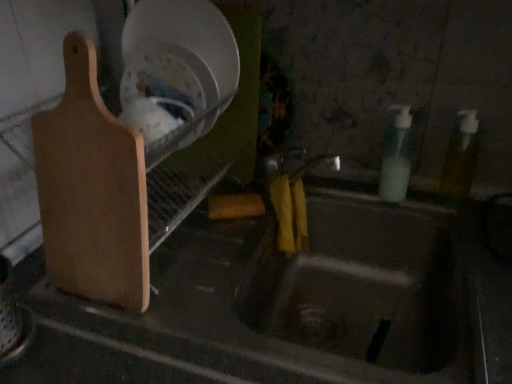
Where is `metallic sink at center`? metallic sink at center is located at coordinates (357, 285).

Describe the element at coordinates (396, 157) in the screenshot. The height and width of the screenshot is (384, 512). I see `translucent plastic soap dispenser at right, which is the first bottle in left-to-right order` at that location.

The height and width of the screenshot is (384, 512). What do you see at coordinates (92, 190) in the screenshot?
I see `light brown wood cutting board at left` at bounding box center [92, 190].

The width and height of the screenshot is (512, 384). In order to click on metallic sink at center in this screenshot , I will do `click(357, 285)`.

Does translucent plastic soap dispenser at right, which ranks as the second bottle in right-to-left order, turn towards translucent yellow bottle at right, the 2th bottle when ordered from left to right?

No, translucent plastic soap dispenser at right, which ranks as the second bottle in right-to-left order, does not turn towards translucent yellow bottle at right, the 2th bottle when ordered from left to right.

Can you tell me how much translucent plastic soap dispenser at right, which ranks as the second bottle in right-to-left order, and translucent yellow bottle at right, the 2th bottle when ordered from left to right, differ in facing direction?

The angular difference between translucent plastic soap dispenser at right, which ranks as the second bottle in right-to-left order, and translucent yellow bottle at right, the 2th bottle when ordered from left to right, is 0.00633 degrees.

You are a GUI agent. You are given a task and a screenshot of the screen. Output one action in this format:
    pyautogui.click(x=<x>, y=<y>)
    Task: Click on the bottle below the translucent yellow bottle at right, the 2th bottle when ordered from left to right (from a real-world perspective)
    This screenshot has width=512, height=384.
    Given the screenshot: What is the action you would take?
    pos(396,157)

Is translucent plastic soap dispenser at right, which ranks as the second bottle in right-to-left order, not inside translucent yellow bottle at right, the first bottle when ordered from right to left?

translucent plastic soap dispenser at right, which ranks as the second bottle in right-to-left order, is positioned outside translucent yellow bottle at right, the first bottle when ordered from right to left.

Which object is closer to the camera taking this photo, translucent plastic soap dispenser at right, which ranks as the second bottle in right-to-left order, or metallic sink at center?

metallic sink at center.

Between translucent plastic soap dispenser at right, which is the first bottle in left-to-right order, and metallic sink at center, which one appears on the right side from the viewer's perspective?

From the viewer's perspective, translucent plastic soap dispenser at right, which is the first bottle in left-to-right order, appears more on the right side.

Is metallic sink at center a part of translucent plastic soap dispenser at right, which is the first bottle in left-to-right order?

No.

From the image's perspective, would you say translucent plastic soap dispenser at right, which is the first bottle in left-to-right order, is shown under metallic sink at center?

No, from the image's perspective, translucent plastic soap dispenser at right, which is the first bottle in left-to-right order, is not below metallic sink at center.

From the image's perspective, is translucent yellow bottle at right, the first bottle when ordered from right to left, beneath metallic sink at center?

No, from the image's perspective, translucent yellow bottle at right, the first bottle when ordered from right to left, is not beneath metallic sink at center.

In the scene shown: Is the position of translucent yellow bottle at right, the 2th bottle when ordered from left to right, more distant than that of metallic sink at center?

Yes, translucent yellow bottle at right, the 2th bottle when ordered from left to right, is further from the viewer.

In the image, is translucent yellow bottle at right, the first bottle when ordered from right to left, on the left side or the right side of metallic sink at center?

translucent yellow bottle at right, the first bottle when ordered from right to left, is positioned on metallic sink at center's right side.

Is translucent yellow bottle at right, the first bottle when ordered from right to left, thinner than metallic sink at center?

Correct, the width of translucent yellow bottle at right, the first bottle when ordered from right to left, is less than that of metallic sink at center.

Locate an element on the screen. Image resolution: width=512 pixels, height=384 pixels. cutting board in front of the metallic sink at center is located at coordinates (92, 190).

Who is smaller, metallic sink at center or light brown wood cutting board at left?

light brown wood cutting board at left.

Between metallic sink at center and light brown wood cutting board at left, which one appears on the left side from the viewer's perspective?

From the viewer's perspective, light brown wood cutting board at left appears more on the left side.

Is metallic sink at center surrounding light brown wood cutting board at left?

That's incorrect, light brown wood cutting board at left is not inside metallic sink at center.

Considering the points (457, 139) and (97, 115), which point is in front, point (457, 139) or point (97, 115)?

The point (97, 115) is more forward.

Are translucent yellow bottle at right, the first bottle when ordered from right to left, and light brown wood cutting board at left beside each other?

No, translucent yellow bottle at right, the first bottle when ordered from right to left, is not with light brown wood cutting board at left.

Between translucent yellow bottle at right, the 2th bottle when ordered from left to right, and light brown wood cutting board at left, which one is positioned behind?

translucent yellow bottle at right, the 2th bottle when ordered from left to right, is more distant.

Based on their positions, is light brown wood cutting board at left located to the left or right of translucent plastic soap dispenser at right, which ranks as the second bottle in right-to-left order?

light brown wood cutting board at left is to the left of translucent plastic soap dispenser at right, which ranks as the second bottle in right-to-left order.

Which object is closer to the camera, light brown wood cutting board at left or translucent plastic soap dispenser at right, which is the first bottle in left-to-right order?

light brown wood cutting board at left is closer to the camera.

Is light brown wood cutting board at left located outside translucent plastic soap dispenser at right, which is the first bottle in left-to-right order?

Yes, light brown wood cutting board at left is outside of translucent plastic soap dispenser at right, which is the first bottle in left-to-right order.

Looking at this image, is light brown wood cutting board at left not near translucent plastic soap dispenser at right, which ranks as the second bottle in right-to-left order?

They are positioned close to each other.

Is light brown wood cutting board at left looking in the opposite direction of metallic sink at center?

No, light brown wood cutting board at left's orientation is not away from metallic sink at center.

Identify the location of sink on the right of the light brown wood cutting board at left. (357, 285).

Is light brown wood cutting board at left thinner than metallic sink at center?

Yes, light brown wood cutting board at left is thinner than metallic sink at center.

Where is `bottle lying below the translucent plastic soap dispenser at right, which ranks as the second bottle in right-to-left order (from the image's perspective)`? The width and height of the screenshot is (512, 384). bottle lying below the translucent plastic soap dispenser at right, which ranks as the second bottle in right-to-left order (from the image's perspective) is located at coordinates (460, 158).

The image size is (512, 384). I want to click on sink in front of the translucent plastic soap dispenser at right, which is the first bottle in left-to-right order, so click(357, 285).

From the image, which object appears to be farther from light brown wood cutting board at left, metallic sink at center or translucent yellow bottle at right, the 2th bottle when ordered from left to right?

translucent yellow bottle at right, the 2th bottle when ordered from left to right.

Based on their spatial positions, is translucent plastic soap dispenser at right, which ranks as the second bottle in right-to-left order, or metallic sink at center closer to translucent yellow bottle at right, the first bottle when ordered from right to left?

translucent plastic soap dispenser at right, which ranks as the second bottle in right-to-left order, is positioned closer to the anchor translucent yellow bottle at right, the first bottle when ordered from right to left.

From the image, which object appears to be farther from translucent yellow bottle at right, the first bottle when ordered from right to left, translucent plastic soap dispenser at right, which ranks as the second bottle in right-to-left order, or light brown wood cutting board at left?

light brown wood cutting board at left is positioned further to the anchor translucent yellow bottle at right, the first bottle when ordered from right to left.

When comparing their distances from metallic sink at center, does translucent yellow bottle at right, the first bottle when ordered from right to left, or translucent plastic soap dispenser at right, which is the first bottle in left-to-right order, seem further?

The object further to metallic sink at center is translucent yellow bottle at right, the first bottle when ordered from right to left.

Based on their spatial positions, is translucent plastic soap dispenser at right, which is the first bottle in left-to-right order, or light brown wood cutting board at left closer to metallic sink at center?

translucent plastic soap dispenser at right, which is the first bottle in left-to-right order, lies closer to metallic sink at center than the other object.

When comparing their distances from light brown wood cutting board at left, does translucent plastic soap dispenser at right, which ranks as the second bottle in right-to-left order, or translucent yellow bottle at right, the first bottle when ordered from right to left, seem closer?

translucent plastic soap dispenser at right, which ranks as the second bottle in right-to-left order.

From the image, which object appears to be nearer to metallic sink at center, translucent plastic soap dispenser at right, which is the first bottle in left-to-right order, or translucent yellow bottle at right, the first bottle when ordered from right to left?

translucent plastic soap dispenser at right, which is the first bottle in left-to-right order.

Based on their spatial positions, is translucent yellow bottle at right, the 2th bottle when ordered from left to right, or light brown wood cutting board at left further from translucent plastic soap dispenser at right, which is the first bottle in left-to-right order?

light brown wood cutting board at left lies further to translucent plastic soap dispenser at right, which is the first bottle in left-to-right order, than the other object.

You are a GUI agent. You are given a task and a screenshot of the screen. Output one action in this format:
    pyautogui.click(x=<x>, y=<y>)
    Task: Click on the sink between light brown wood cutting board at left and translucent yellow bottle at right, the first bottle when ordered from right to left, from left to right
    This screenshot has width=512, height=384.
    Given the screenshot: What is the action you would take?
    pyautogui.click(x=357, y=285)

The height and width of the screenshot is (384, 512). What are the coordinates of `bottle situated between light brown wood cutting board at left and translucent yellow bottle at right, the 2th bottle when ordered from left to right, from left to right` in the screenshot? It's located at (396, 157).

In order to click on bottle between translucent plastic soap dispenser at right, which ranks as the second bottle in right-to-left order, and metallic sink at center in the up-down direction in this screenshot , I will do `click(460, 158)`.

You are a GUI agent. You are given a task and a screenshot of the screen. Output one action in this format:
    pyautogui.click(x=<x>, y=<y>)
    Task: Click on the sink located between light brown wood cutting board at left and translucent plastic soap dispenser at right, which is the first bottle in left-to-right order, in the left-right direction
    This screenshot has width=512, height=384.
    Given the screenshot: What is the action you would take?
    pyautogui.click(x=357, y=285)